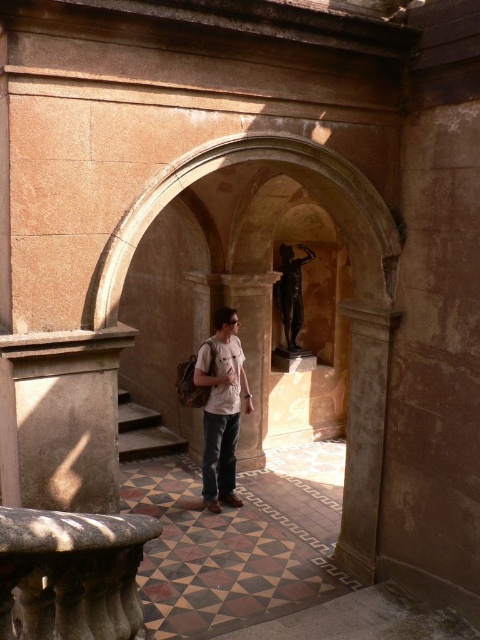
Who is taller, white cotton shirt at center or smooth stone stairs at center?

Standing taller between the two is white cotton shirt at center.

Who is lower down, white cotton shirt at center or smooth stone stairs at center?

smooth stone stairs at center

The image size is (480, 640). I want to click on white cotton shirt at center, so coord(222,410).

Is marble balustrade at lower left below white cotton shirt at center?

Yes.

Who is more forward, (86, 609) or (204, 422)?

Point (86, 609)

You are a GUI agent. You are given a task and a screenshot of the screen. Output one action in this format:
    pyautogui.click(x=<x>, y=<y>)
    Task: Click on the marble balustrade at lower left
    The height and width of the screenshot is (640, 480).
    Given the screenshot: What is the action you would take?
    pyautogui.click(x=72, y=572)

Who is shorter, marble balustrade at lower left or bronze statue at center?

With less height is marble balustrade at lower left.

Can you confirm if marble balustrade at lower left is thinner than bronze statue at center?

Yes.

Which is in front, point (71, 560) or point (300, 244)?

Point (71, 560) is in front.

Identify the location of marble balustrade at lower left. This screenshot has width=480, height=640. (72, 572).